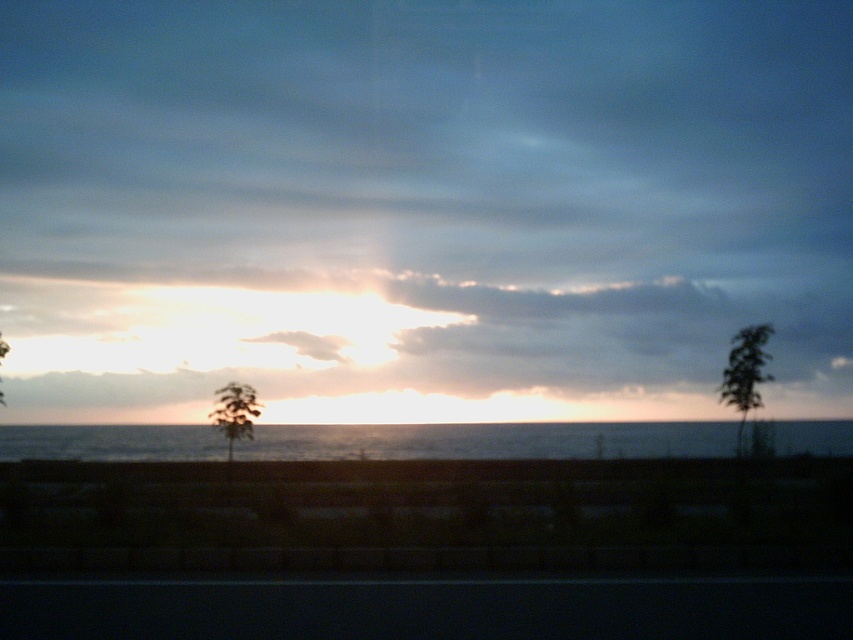
You are standing on the beach facing the sunset. You notice two green leafy trees in the scene. Which tree, the green leafy tree at right or the green leafy tree at center, is taller?

The green leafy tree at right is taller than the green leafy tree at center.

You are observing the sunset scene and notice the smokey gray cloud at upper center. Based on its position, can you determine if it is closer to the horizon or the top of the sky?

The smokey gray cloud at upper center is located at point coordinates that place it closer to the horizon than the top of the sky.

You are a painter observing the sunset scene. You want to paint the green leafy tree at center and the golden translucent clouds at center accurately. Based on their positions, which object should you paint first to ensure proper layering?

The green leafy tree at center is behind the golden translucent clouds at center, so you should paint the golden translucent clouds at center first to ensure proper layering.